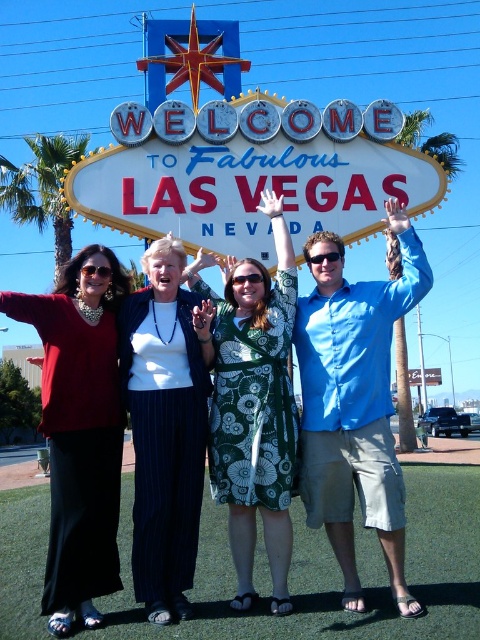
You are a photographer trying to capture a photo of the group. You notice the blue cotton shirt at center and the green floral dress at center. Which clothing item might be more likely to block the view of the background sign due to its height?

The blue cotton shirt at center is much taller than the green floral dress at center, so it might block the view of the background sign more.

You are a photographer trying to capture a group photo of the two women and two men in front of the white metallic sign at center. Since the white knit sweater at center is part of their outfit, can you suggest if the sign will be more prominent in the photo compared to the sweater?

The white metallic sign at center is larger in width than the white knit sweater at center, so the sign will be more prominent in the photo compared to the sweater.

You are a photographer trying to capture a group photo of the two people wearing the blue cotton shirt at center and white knit sweater at center. If you want to ensure both are fully visible in the frame, which one should you position closer to the camera to avoid cropping?

The blue cotton shirt at center might be wider than white knit sweater at center, so positioning the person wearing the blue cotton shirt at center closer to the camera would help ensure both are fully visible without cropping.